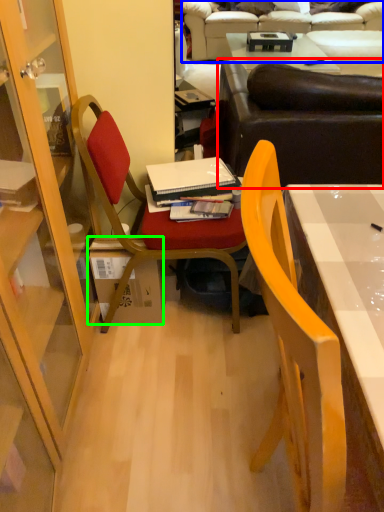
Question: Which object is the farthest from studio couch (highlighted by a red box)? Choose among these: studio couch (highlighted by a blue box) or box (highlighted by a green box).

Choices:
 (A) studio couch
 (B) box

Answer: (A)